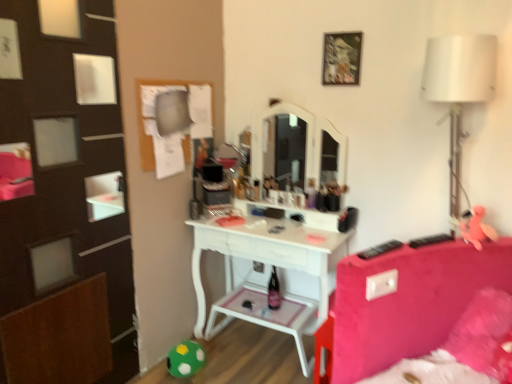
Question: Can you confirm if green felt ball at lower left, placed as the 1th toy when sorted from bottom to top, is bigger than white fabric lampshade at right?

Choices:
 (A) yes
 (B) no

Answer: (B)

Question: Is green felt ball at lower left, placed as the 1th toy when sorted from bottom to top, further to the viewer compared to white fabric lampshade at right?

Choices:
 (A) no
 (B) yes

Answer: (B)

Question: Is green felt ball at lower left, the 2th toy in the top-to-bottom sequence, smaller than white fabric lampshade at right?

Choices:
 (A) yes
 (B) no

Answer: (A)

Question: Would you say green felt ball at lower left, which appears as the second toy when viewed from the front, contains white fabric lampshade at right?

Choices:
 (A) no
 (B) yes

Answer: (A)

Question: Does green felt ball at lower left, which appears as the first toy when viewed from the left, have a greater width compared to white fabric lampshade at right?

Choices:
 (A) yes
 (B) no

Answer: (B)

Question: Is green felt ball at lower left, the 2th toy in the top-to-bottom sequence, positioned beyond the bounds of white fabric lampshade at right?

Choices:
 (A) yes
 (B) no

Answer: (A)

Question: Is green felt ball at lower left, the 2th toy in the top-to-bottom sequence, at the left side of wooden picture frame at upper center?

Choices:
 (A) yes
 (B) no

Answer: (A)

Question: Is the surface of green felt ball at lower left, which appears as the 1th toy when viewed from the back, in direct contact with wooden picture frame at upper center?

Choices:
 (A) yes
 (B) no

Answer: (B)

Question: Can you confirm if green felt ball at lower left, which appears as the 1th toy when viewed from the back, is bigger than wooden picture frame at upper center?

Choices:
 (A) yes
 (B) no

Answer: (A)

Question: From the image's perspective, is green felt ball at lower left, the 2th toy in the top-to-bottom sequence, beneath wooden picture frame at upper center?

Choices:
 (A) no
 (B) yes

Answer: (B)

Question: Is green felt ball at lower left, which appears as the 1th toy when viewed from the back, thinner than wooden picture frame at upper center?

Choices:
 (A) no
 (B) yes

Answer: (A)

Question: Is green felt ball at lower left, which appears as the 1th toy when viewed from the back, facing towards pink rubber duck at right, which is counted as the 2th toy, starting from the bottom?

Choices:
 (A) no
 (B) yes

Answer: (A)